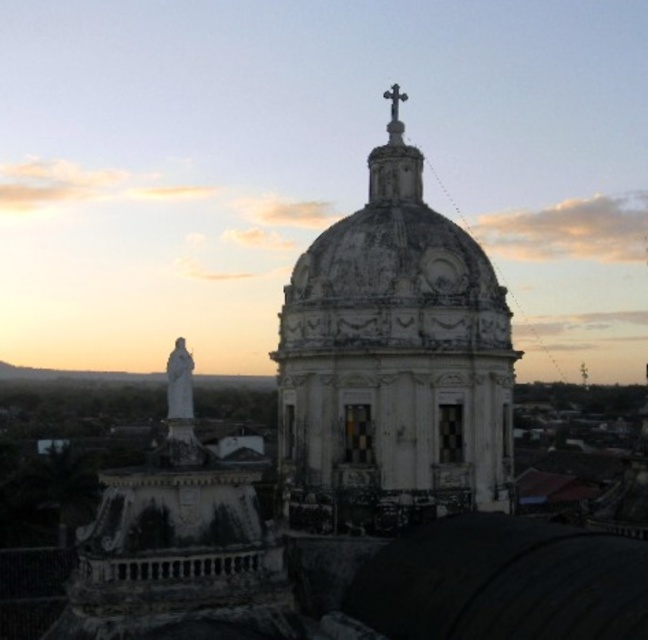
Question: Which point appears closest to the camera in this image?

Choices:
 (A) (295, 332)
 (B) (397, 102)

Answer: (A)

Question: Among these points, which one is farthest from the camera?

Choices:
 (A) (397, 113)
 (B) (345, 284)

Answer: (A)

Question: Is white stone dome at center above polished silver cross at upper center?

Choices:
 (A) no
 (B) yes

Answer: (A)

Question: Does white stone dome at center appear on the left side of polished silver cross at upper center?

Choices:
 (A) no
 (B) yes

Answer: (B)

Question: Among these objects, which one is nearest to the camera?

Choices:
 (A) polished silver cross at upper center
 (B) white stone dome at center

Answer: (B)

Question: Is white stone dome at center thinner than polished silver cross at upper center?

Choices:
 (A) no
 (B) yes

Answer: (A)